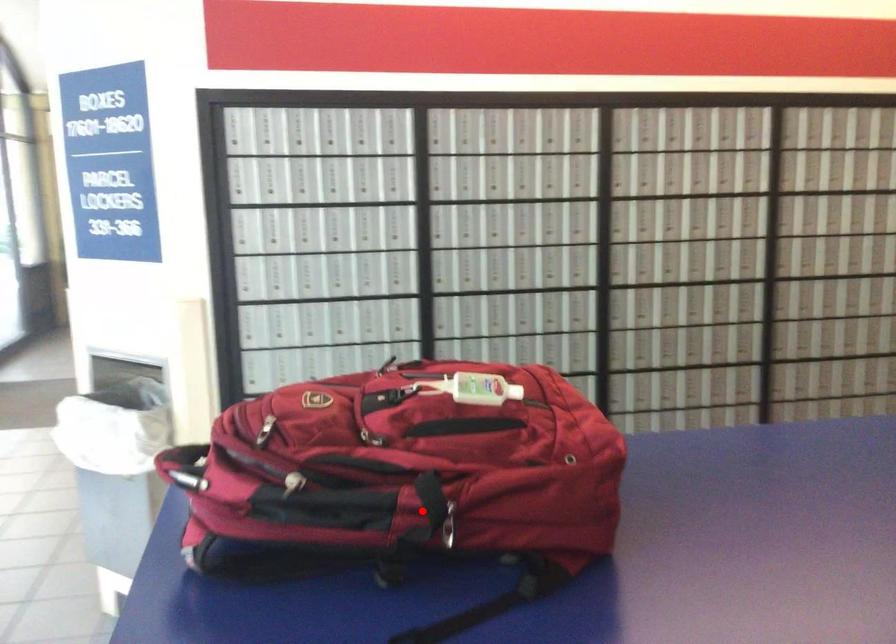
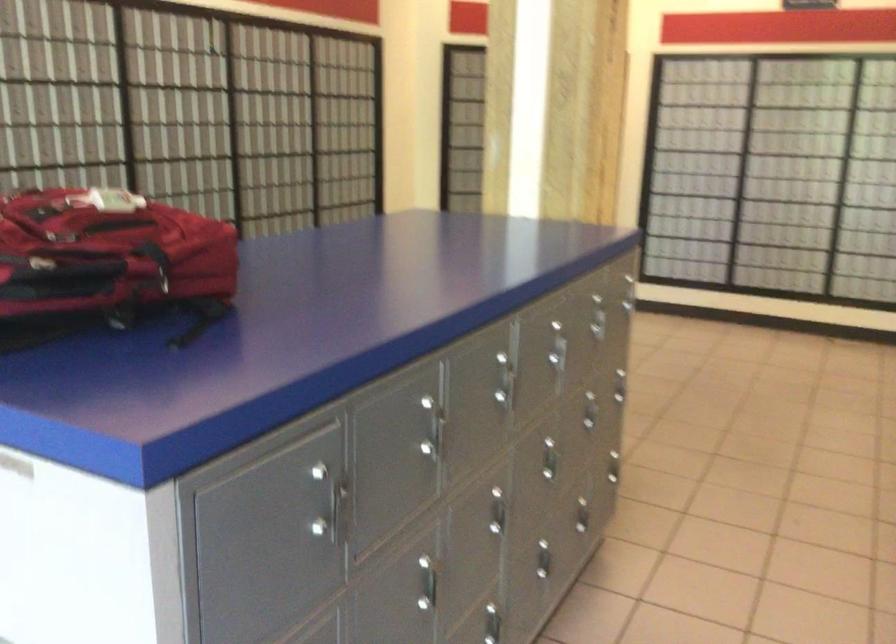
In the second image, find the point that corresponds to the highlighted location in the first image.

(156, 263)